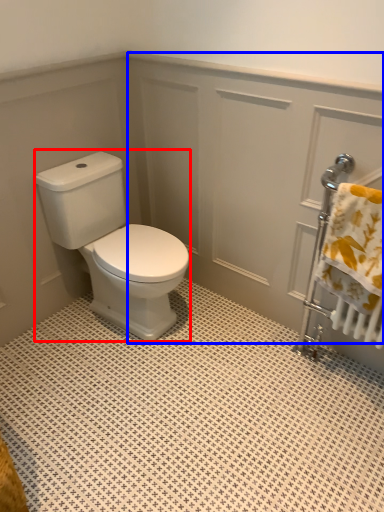
Question: Which of the following is the closest to the observer, porcelain (highlighted by a red box) or screen door (highlighted by a blue box)?

Choices:
 (A) porcelain
 (B) screen door

Answer: (B)